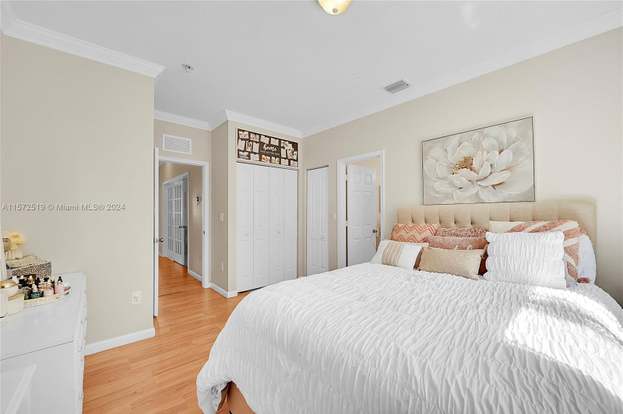
Where is `doors`? This screenshot has height=414, width=623. doors is located at coordinates (173, 208), (265, 231), (321, 231), (361, 220).